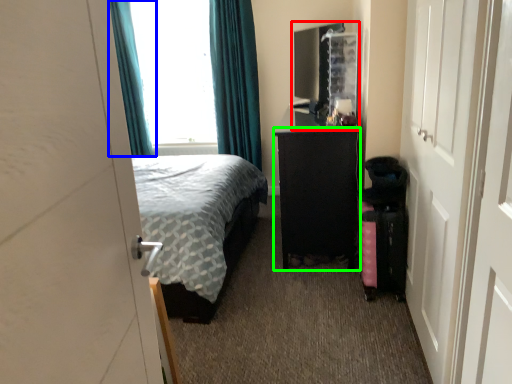
Question: Estimate the real-world distances between objects in this image. Which object is closer to file cabinet (highlighted by a red box), curtain (highlighted by a blue box) or furniture (highlighted by a green box)?

Choices:
 (A) curtain
 (B) furniture

Answer: (B)